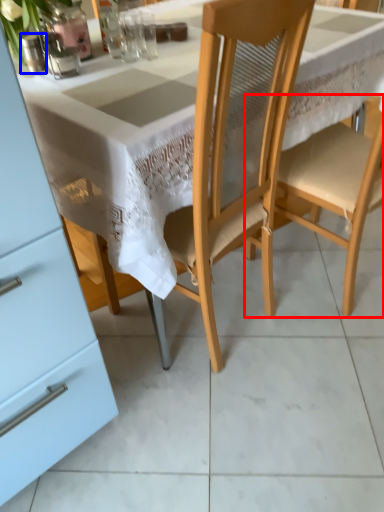
Question: Which object is further to the camera taking this photo, chair (highlighted by a red box) or tableware (highlighted by a blue box)?

Choices:
 (A) chair
 (B) tableware

Answer: (B)